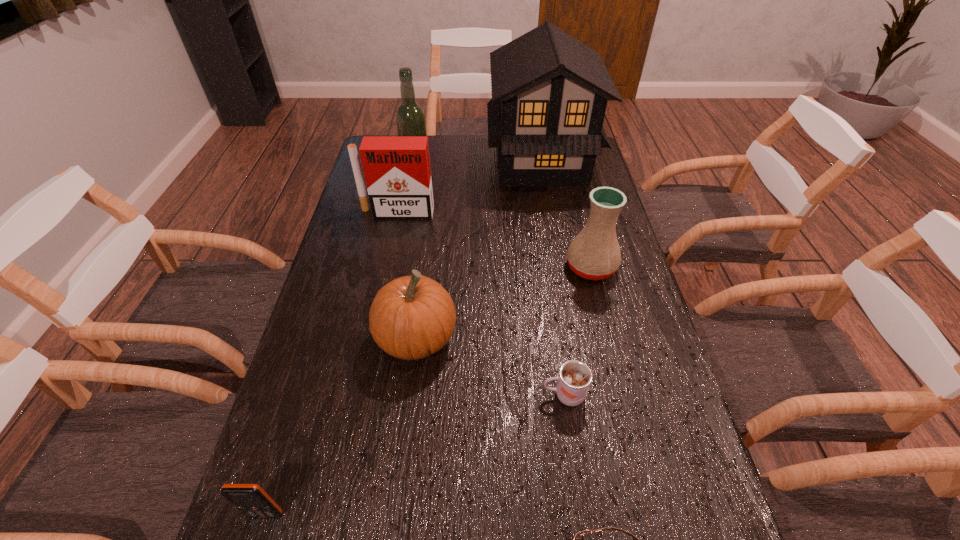
Image resolution: width=960 pixels, height=540 pixels. I want to click on dollhouse, so click(549, 91).

Where is `the seventh shortest object`? This screenshot has height=540, width=960. the seventh shortest object is located at coordinates pyautogui.click(x=410, y=118).

Identify the location of the third farthest object. click(397, 171).

Identify the location of the fifth nearest object. This screenshot has width=960, height=540. (594, 254).

Find the location of a particular element. This screenshot has height=540, width=960. the fifth farthest object is located at coordinates (412, 317).

You are a GUI agent. You are given a task and a screenshot of the screen. Output one action in this format:
    pyautogui.click(x=<x>, y=<y>)
    Task: Click on the cellular telephone
    This screenshot has width=960, height=540.
    Given the screenshot: What is the action you would take?
    pyautogui.click(x=250, y=499)

Find the location of a particular element. The width and height of the screenshot is (960, 540). the seventh farthest object is located at coordinates (250, 499).

This screenshot has width=960, height=540. Identify the location of the seventh tallest object. (574, 379).

Where is `cup`? The image size is (960, 540). cup is located at coordinates (574, 379).

Identify the location of free space located on the front-facing side of the tallest object. (390, 162).